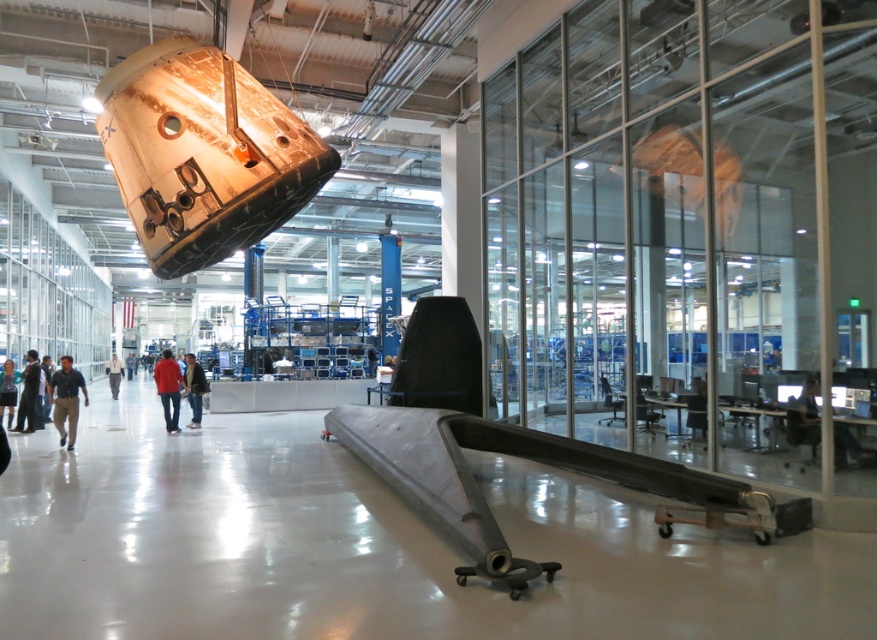
You are an engineer in the facility and need to access the black glossy computer at lower right. However, there is a person wearing a matte black shirt at center in your way. Can you step around them to reach the computer?

The black glossy computer at lower right is positioned over matte black shirt at center, meaning the computer is directly above the person. Since the computer is suspended or placed above, you can step around the person wearing the matte black shirt at center to reach the computer without obstruction.

You are an engineer in the facility and need to access both the black glossy computer at lower right and the matte black jacket at center. Which object is closer to you?

The black glossy computer at lower right is closer to the viewer than the matte black jacket at center.